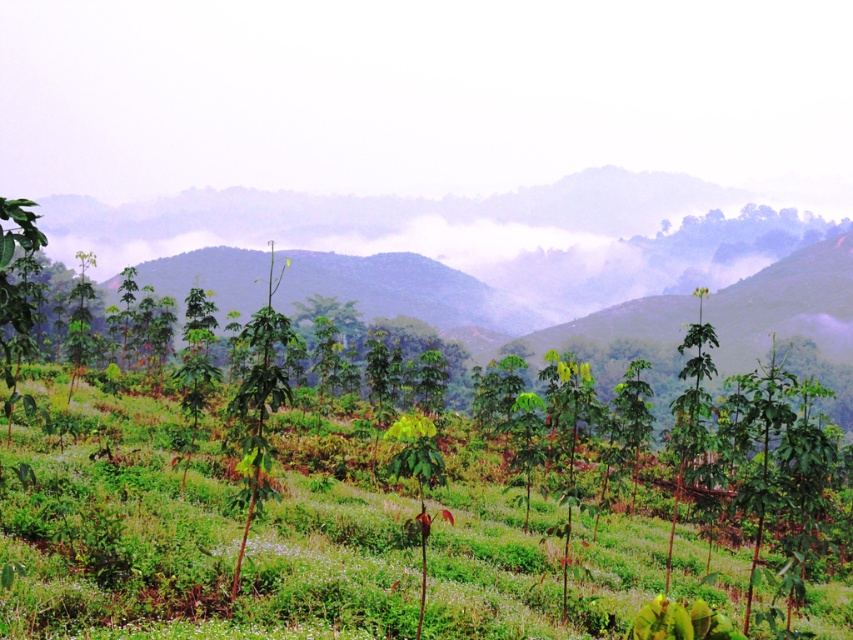
You are standing in the middle of the field and see the green leafy grass at center and the green leafy tree at center. Which one is closer to the ground?

The green leafy grass at center is closer to the ground because it is positioned below the green leafy tree at center.

You are a gardener standing at the edge of the field. You need to water both the green leafy grass at center and the green leafy tree at center. Which one is closer to you?

The green leafy grass at center is 7.28 meters from the green leafy tree at center. Since you are at the edge of the field, the distance between them doesn

You are standing in the middle of the field and see the green leafy grass at center and the green leafy tree at center. Which one is more to the right?

The green leafy grass at center is more to the right because it is positioned on the right side of the green leafy tree at center.